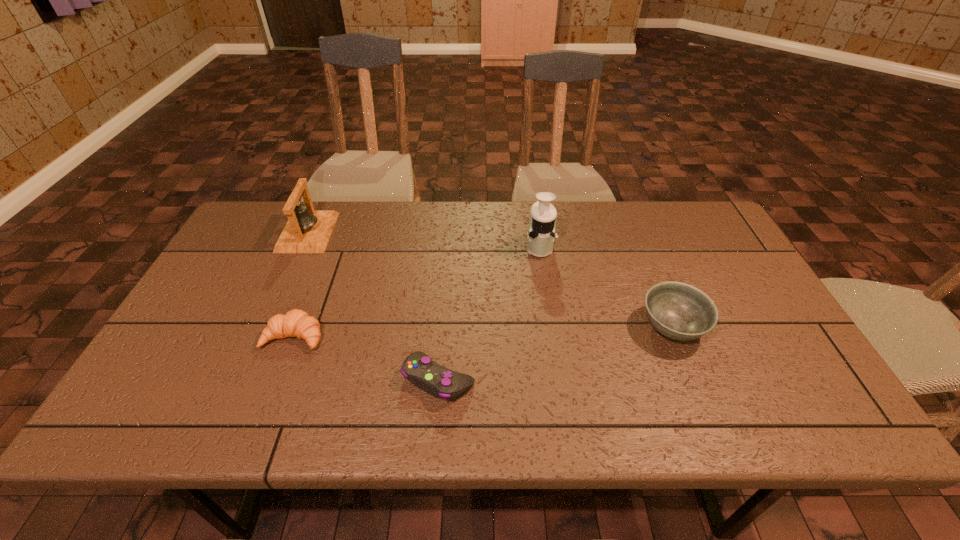
At what (x,y) coordinates should I click in order to perform the action: click on juicer. Please return your answer as a coordinate pair (x, y). The height and width of the screenshot is (540, 960). Looking at the image, I should click on (541, 231).

You are a GUI agent. You are given a task and a screenshot of the screen. Output one action in this format:
    pyautogui.click(x=<x>, y=<y>)
    Task: Click on the tallest object
    The width and height of the screenshot is (960, 540).
    Given the screenshot: What is the action you would take?
    pyautogui.click(x=541, y=231)

Where is `bell`? This screenshot has height=540, width=960. bell is located at coordinates (307, 230).

Locate an element on the screen. bowl is located at coordinates (679, 311).

The image size is (960, 540). I want to click on the third shortest object, so click(679, 311).

This screenshot has width=960, height=540. What are the coordinates of `crescent roll` in the screenshot? It's located at (297, 323).

Locate an element on the screen. The image size is (960, 540). control is located at coordinates (434, 379).

Where is `free spot located 0.310m on the left of the tallest object`? This screenshot has width=960, height=540. free spot located 0.310m on the left of the tallest object is located at coordinates (423, 247).

The height and width of the screenshot is (540, 960). Find the location of `vacant space situated 0.210m on the right of the bell`. vacant space situated 0.210m on the right of the bell is located at coordinates pos(398,232).

At what (x,y) coordinates should I click in order to perform the action: click on vacant space situated 0.120m on the back of the rightmost object. Please return your answer as a coordinate pair (x, y). Image resolution: width=960 pixels, height=540 pixels. Looking at the image, I should click on (650, 272).